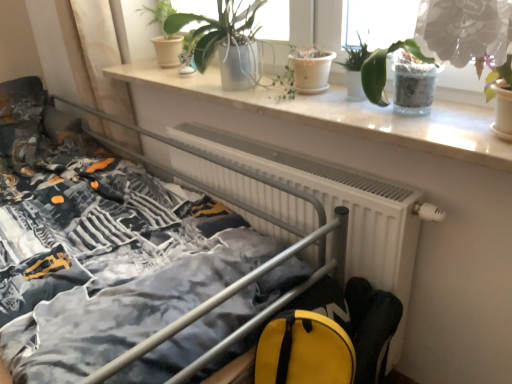
Locate an element on the screen. This screenshot has height=384, width=512. unoccupied area behind green glossy plant at upper right, which appears as the first houseplant when viewed from the right is located at coordinates (460, 107).